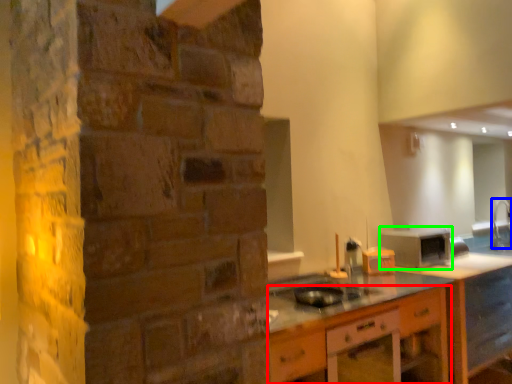
Question: Estimate the real-world distances between objects in this image. Which object is closer to cabinetry (highlighted by a red box), faucet (highlighted by a blue box) or appliance (highlighted by a green box)?

Choices:
 (A) faucet
 (B) appliance

Answer: (B)